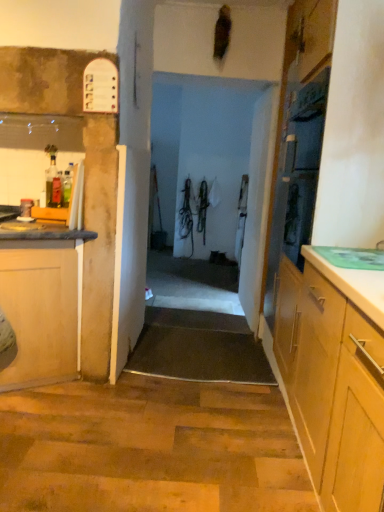
Find the location of a particular element. This screenshot has height=512, width=384. wooden cabinet at left is located at coordinates click(x=42, y=302).

The width and height of the screenshot is (384, 512). What do you see at coordinates (42, 302) in the screenshot?
I see `wooden cabinet at left` at bounding box center [42, 302].

What is the approximate width of wooden cabinet at left?

The width of wooden cabinet at left is 30.08 inches.

Measure the distance between wooden cabinet at left and camera.

A distance of 6.95 feet exists between wooden cabinet at left and camera.

Locate an element on the screen. The height and width of the screenshot is (512, 384). white matte door at center is located at coordinates (132, 178).

Describe the element at coordinates (132, 178) in the screenshot. Image resolution: width=384 pixels, height=512 pixels. I see `white matte door at center` at that location.

Where is `wooden cabinet at left`? wooden cabinet at left is located at coordinates (42, 302).

Looking at this image, is wooden cabinet at left to the left of white matte door at center from the viewer's perspective?

Correct, you'll find wooden cabinet at left to the left of white matte door at center.

Is wooden cabinet at left in front of or behind white matte door at center in the image?

Clearly, wooden cabinet at left is in front of white matte door at center.

Between point (17, 330) and point (124, 81), which one is positioned in front?

The point (17, 330) is in front.

From the image's perspective, which is below, wooden cabinet at left or white matte door at center?

wooden cabinet at left, from the image's perspective.

From the picture: From a real-world perspective, which is physically below, wooden cabinet at left or white matte door at center?

wooden cabinet at left.

Is wooden cabinet at left thinner than white matte door at center?

Yes.

Looking at this image, between wooden cabinet at left and white matte door at center, which one has less height?

wooden cabinet at left is shorter.

Is wooden cabinet at left smaller than white matte door at center?

No, wooden cabinet at left is not smaller than white matte door at center.

Is wooden cabinet at left positioned beyond the bounds of white matte door at center?

Yes, wooden cabinet at left is located beyond the bounds of white matte door at center.

Is wooden cabinet at left next to white matte door at center?

No, wooden cabinet at left is not in contact with white matte door at center.

Is wooden cabinet at left positioned with its back to white matte door at center?

No, wooden cabinet at left's orientation is not away from white matte door at center.

How different are the orientations of wooden cabinet at left and white matte door at center in degrees?

The angle between the facing direction of wooden cabinet at left and the facing direction of white matte door at center is 0.26 degrees.

At what (x,y) coordinates should I click in order to perform the action: click on cabinetry below the white matte door at center (from the image's perspective). Please return your answer as a coordinate pair (x, y). This screenshot has width=384, height=512. Looking at the image, I should click on tap(42, 302).

Between white matte door at center and wooden cabinet at left, which one appears on the left side from the viewer's perspective?

wooden cabinet at left is more to the left.

Between white matte door at center and wooden cabinet at left, which one is positioned in front?

wooden cabinet at left is more forward.

Does point (132, 161) appear closer or farther from the camera than point (54, 228)?

Point (132, 161).

From the image's perspective, is white matte door at center located above or below wooden cabinet at left?

From the image's perspective, white matte door at center appears above wooden cabinet at left.

From a real-world perspective, is white matte door at center positioned above or below wooden cabinet at left?

white matte door at center is above wooden cabinet at left.

Is white matte door at center thinner than wooden cabinet at left?

No.

Looking at this image, considering the relative sizes of white matte door at center and wooden cabinet at left in the image provided, is white matte door at center taller than wooden cabinet at left?

Yes.

Considering the relative sizes of white matte door at center and wooden cabinet at left in the image provided, is white matte door at center smaller than wooden cabinet at left?

Correct, white matte door at center occupies less space than wooden cabinet at left.

Is white matte door at center completely or partially outside of wooden cabinet at left?

Yes, white matte door at center is not within wooden cabinet at left.

Looking at this image, is white matte door at center not near wooden cabinet at left?

No, white matte door at center is in close proximity to wooden cabinet at left.

Is white matte door at center oriented towards wooden cabinet at left?

No, white matte door at center is not oriented towards wooden cabinet at left.

What's the angular difference between white matte door at center and wooden cabinet at left's facing directions?

0.26 degrees separate the facing orientations of white matte door at center and wooden cabinet at left.

Where is `cabinetry that is below the white matte door at center (from the image's perspective)`? This screenshot has width=384, height=512. cabinetry that is below the white matte door at center (from the image's perspective) is located at coordinates (42, 302).

What are the coordinates of `door to the right of wooden cabinet at left` in the screenshot? It's located at (132, 178).

Find the location of a particular element. The width and height of the screenshot is (384, 512). door located above the wooden cabinet at left (from a real-world perspective) is located at coordinates (132, 178).